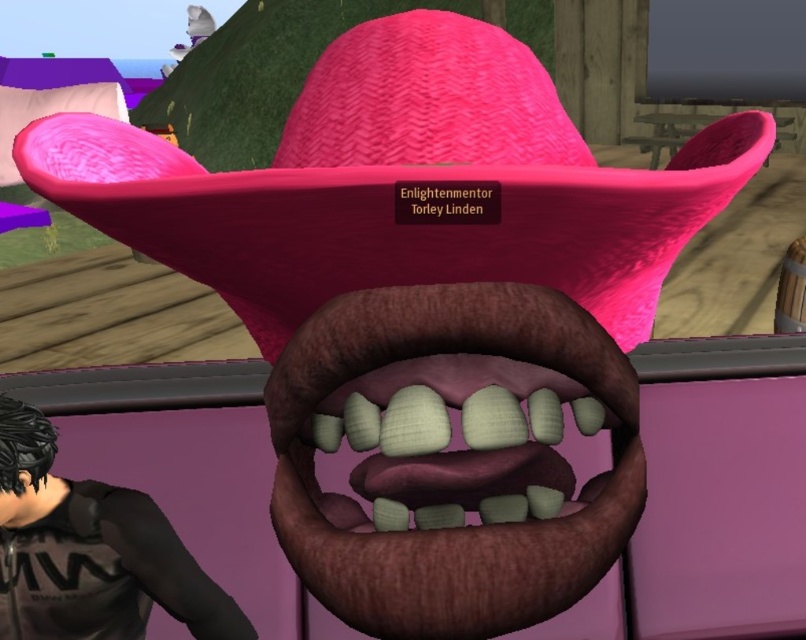
Can you confirm if pink woven hat at center is bigger than black matte shirt at lower left?

Correct, pink woven hat at center is larger in size than black matte shirt at lower left.

Is point (645, 269) positioned behind point (152, 557)?

No, (645, 269) is closer to viewer.

The height and width of the screenshot is (640, 806). What are the coordinates of `pink woven hat at center` in the screenshot? It's located at (403, 188).

Is point (77, 163) closer to camera compared to point (327, 340)?

No, (77, 163) is behind (327, 340).

Measure the distance between pink woven hat at center and camera.

pink woven hat at center is 33.17 centimeters from camera.

Who is more forward, (381, 202) or (269, 376)?

Point (381, 202)

Where is `pink woven hat at center`? The width and height of the screenshot is (806, 640). pink woven hat at center is located at coordinates (403, 188).

Between point (618, 374) and point (10, 467), which one is positioned in front?

Point (618, 374)

Describe the element at coordinates (451, 404) in the screenshot. I see `smooth brown leather mouth at center` at that location.

The image size is (806, 640). I want to click on smooth brown leather mouth at center, so click(x=451, y=404).